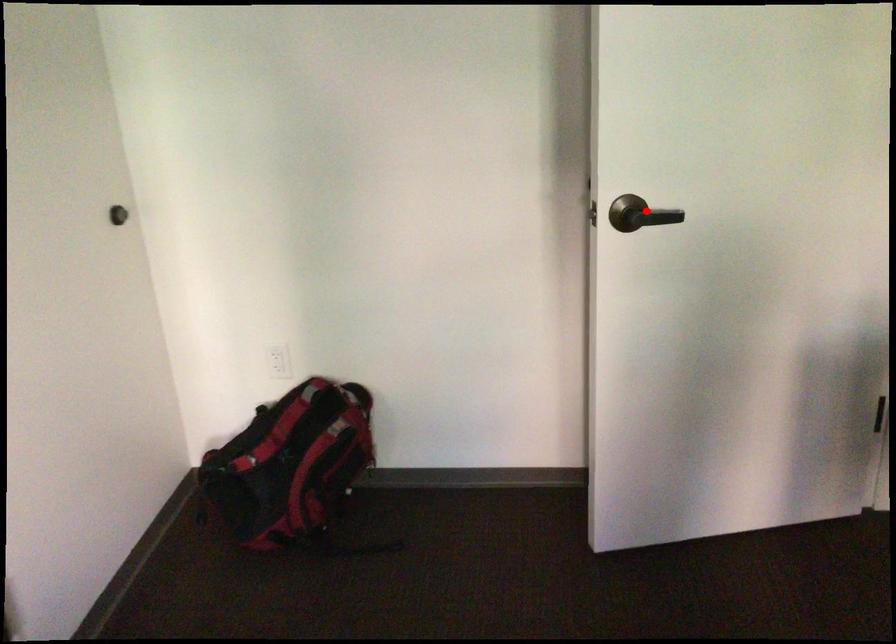
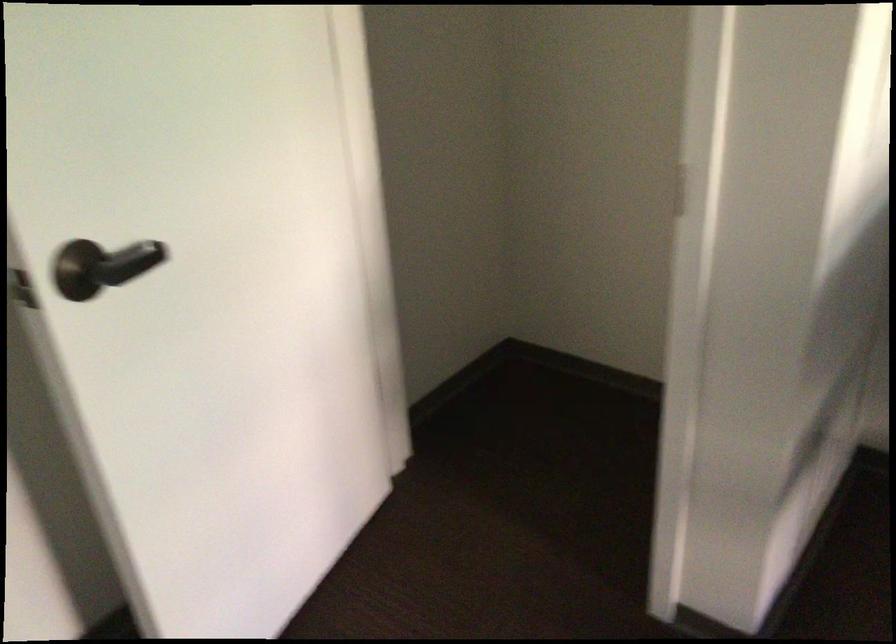
Question: I am providing you with two images of the same scene from different viewpoints. Given a red point in image1, look at the same physical point in image2. Is it:

Choices:
 (A) Closer to the viewpoint
 (B) Farther from the viewpoint

Answer: (A)